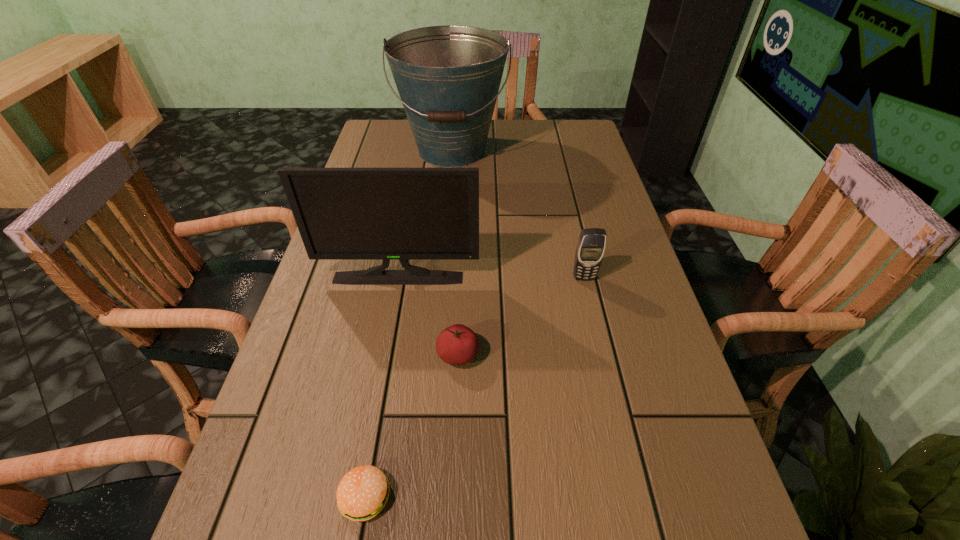
Locate an element on the screen. vacant space at the left edge is located at coordinates pyautogui.click(x=339, y=413).

You are a GUI agent. You are given a task and a screenshot of the screen. Output one action in this format:
    pyautogui.click(x=<x>, y=<y>)
    Task: Click on the free space at the right edge of the desktop
    The width and height of the screenshot is (960, 540).
    Given the screenshot: What is the action you would take?
    pyautogui.click(x=573, y=215)

Where is `vacant space at the far left corner of the desktop`? vacant space at the far left corner of the desktop is located at coordinates (410, 128).

Image resolution: width=960 pixels, height=540 pixels. Identify the location of empty space that is in between the bucket and the cellular telephone. (518, 214).

The width and height of the screenshot is (960, 540). What are the coordinates of `free space between the patty and the cellular telephone` in the screenshot? It's located at (474, 387).

This screenshot has height=540, width=960. In order to click on free space that is in between the fourth farthest object and the patty in this screenshot , I will do `click(412, 426)`.

Locate an element on the screen. The height and width of the screenshot is (540, 960). vacant point located between the tallest object and the patty is located at coordinates (409, 323).

Where is `vacant space that's between the cellular telephone and the bucket`? vacant space that's between the cellular telephone and the bucket is located at coordinates tap(518, 214).

Find the location of `free space between the tallest object and the rightmost object`. free space between the tallest object and the rightmost object is located at coordinates (518, 214).

Identify which object is located as the fourth nearest to the fourth farthest object. Please provide its 2D coordinates. Your answer should be formatted as a tuple, i.e. [(x, y)], where the tuple contains the x and y coordinates of a point satisfying the conditions above.

[(448, 77)]